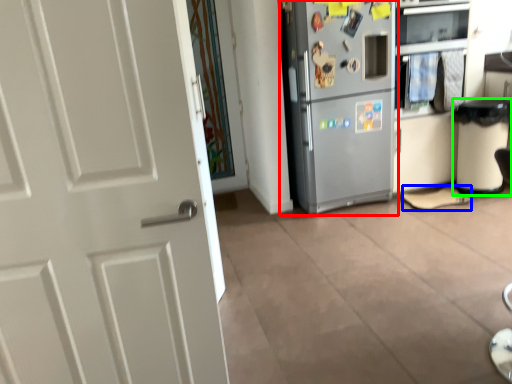
Question: Which object is the farthest from refrigerator (highlighted by a red box)? Choose among these: shoe (highlighted by a blue box) or trash bin/can (highlighted by a green box).

Choices:
 (A) shoe
 (B) trash bin/can

Answer: (B)